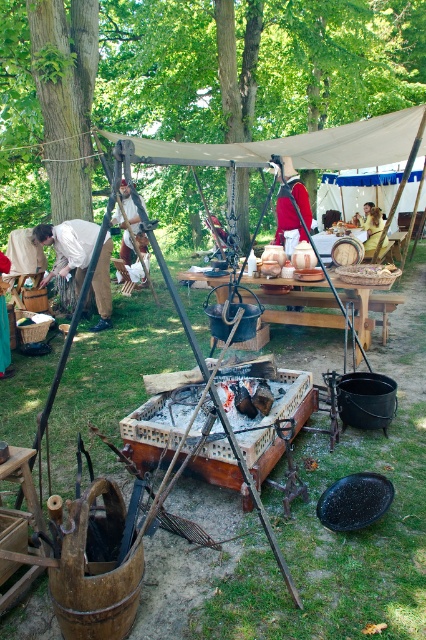
You are a participant in the medieval event and need to locate your costume pieces. You see the matte white shirt at left and the red velvet coat at center. Which costume piece is positioned more to the east?

The matte white shirt at left is positioned to the left of the red velvet coat at center, so it is more to the east if the scene is viewed from the participant perspective facing forward.

You are an archer positioned at the edge of the scene, aiming to shoot an arrow from the matte white shirt at left to the red velvet coat at center. The minimum distance your arrow can travel is 8 feet. Will your arrow reach the target?

The matte white shirt at left is 8.10 feet away from the red velvet coat at center. Since the minimum distance your arrow can travel is 8 feet, the arrow will just barely reach the target.